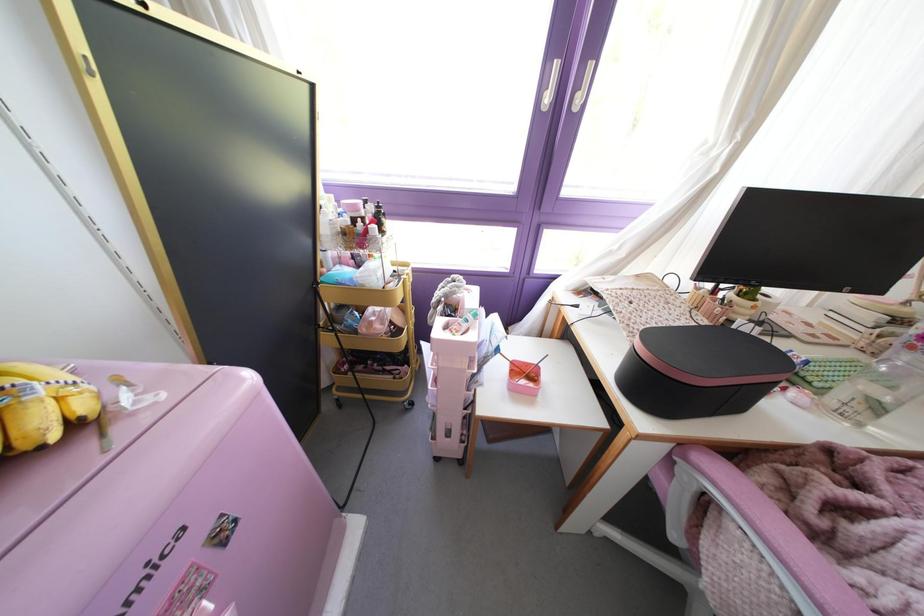
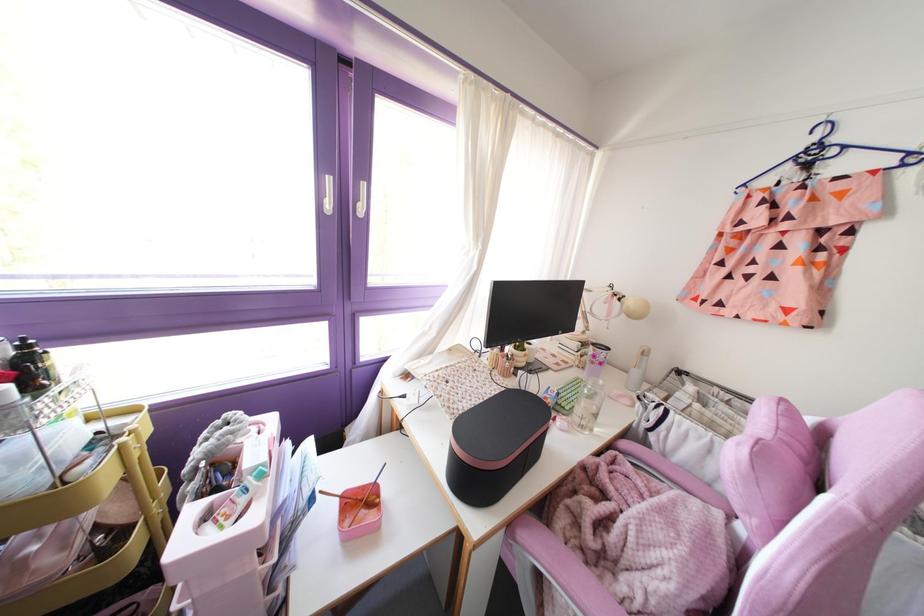
Find the pixel in the second image that matches point (405, 264) in the first image.

(130, 411)